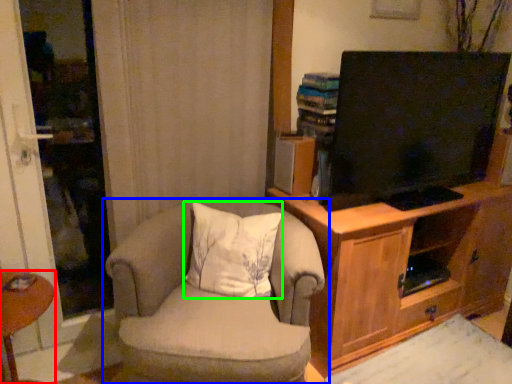
Question: Estimate the real-world distances between objects in this image. Which object is farther from desk (highlighted by a red box), chair (highlighted by a blue box) or pillow (highlighted by a green box)?

Choices:
 (A) chair
 (B) pillow

Answer: (B)